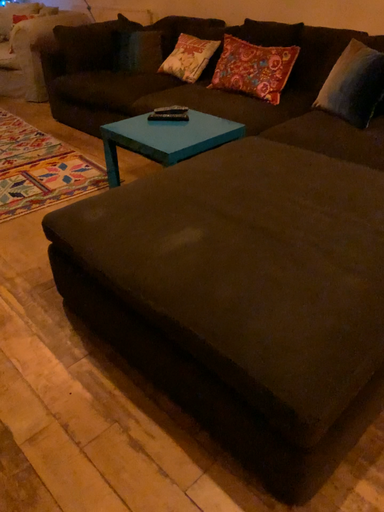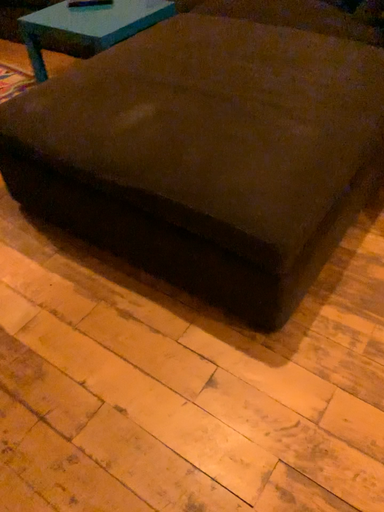
Question: How did the camera likely rotate when shooting the video?

Choices:
 (A) rotated upward
 (B) rotated downward

Answer: (B)